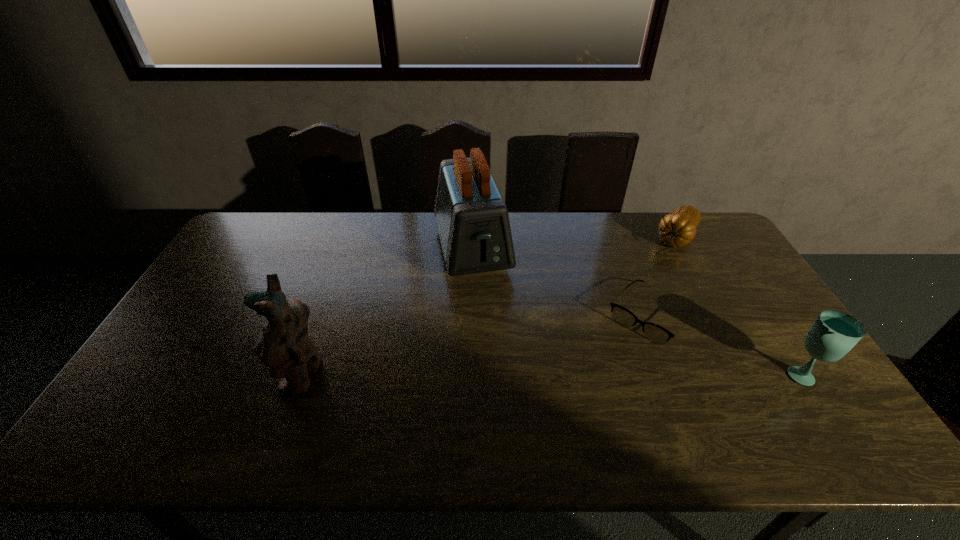
Locate an element on the screen. Image resolution: width=960 pixels, height=540 pixels. gourd located in the far edge section of the desktop is located at coordinates (677, 229).

Locate an element on the screen. This screenshot has width=960, height=540. figurine situated at the near edge is located at coordinates (284, 345).

I want to click on glass that is at the near edge, so click(x=834, y=333).

The height and width of the screenshot is (540, 960). I want to click on glass located in the right edge section of the desktop, so click(x=834, y=333).

Where is `gourd positioned at the right edge`? gourd positioned at the right edge is located at coordinates (677, 229).

At what (x,y) coordinates should I click in order to perform the action: click on object that is at the far right corner. Please return your answer as a coordinate pair (x, y). Looking at the image, I should click on (677, 229).

Find the location of a particular element. This screenshot has width=960, height=540. object present at the near right corner is located at coordinates (834, 333).

The image size is (960, 540). In order to click on vacant area at the far edge in this screenshot , I will do `click(401, 213)`.

Find the location of `vacant space at the near edge`. vacant space at the near edge is located at coordinates (657, 399).

In the image, there is a desktop. Identify the location of free space at the left edge. (231, 268).